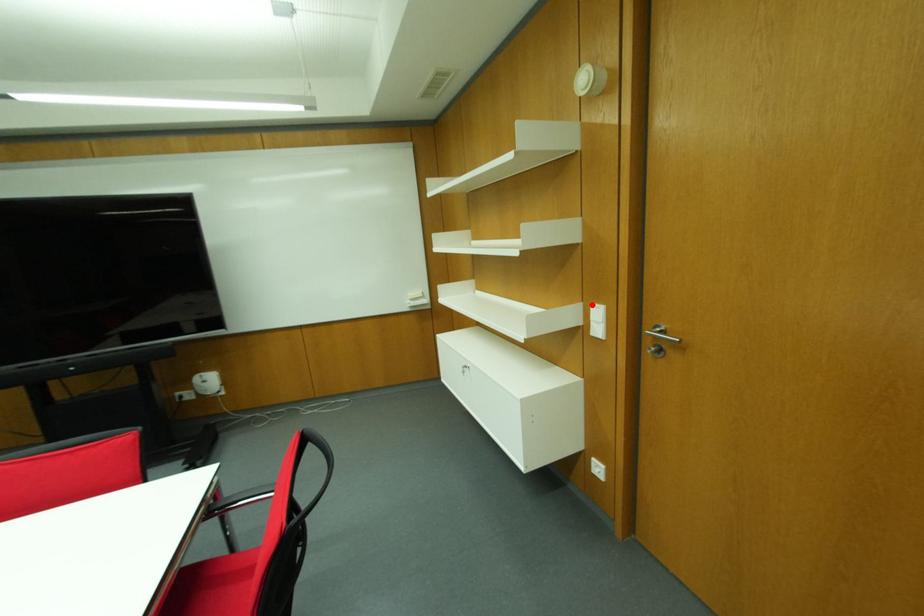
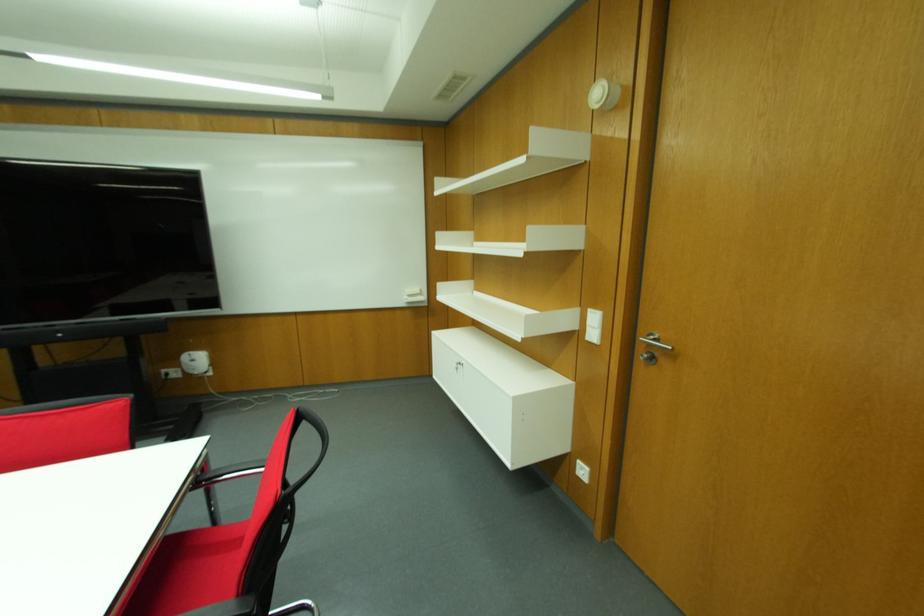
Question: I am providing you with two images of the same scene from different viewpoints. A red point is marked on the first image. Is the red point's position out of view in image 2?

Choices:
 (A) Yes
 (B) No

Answer: (B)